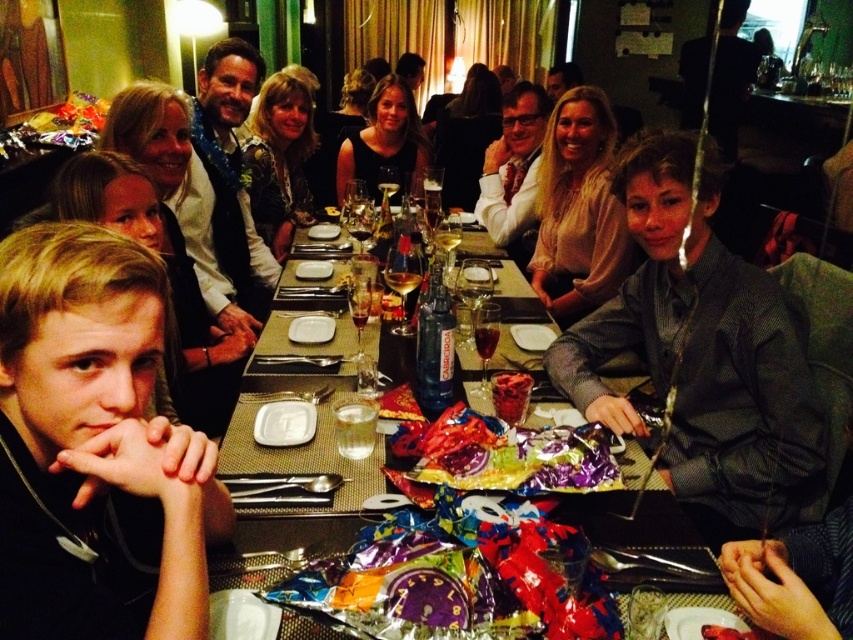
Question: Which point appears closest to the camera in this image?

Choices:
 (A) (376, 577)
 (B) (91, 544)
 (C) (799, 324)
 (D) (280, 145)

Answer: (B)

Question: From the image, what is the correct spatial relationship of dark gray shirt at center in relation to shiny metallic foil at center?

Choices:
 (A) above
 (B) below

Answer: (A)

Question: Can you confirm if black matte shirt at left is positioned above shiny foil wrapped candy at center?

Choices:
 (A) no
 (B) yes

Answer: (B)

Question: From the image, what is the correct spatial relationship of shiny metallic table at center in relation to black matte dress at center?

Choices:
 (A) left
 (B) right

Answer: (B)

Question: Which object is positioned closest to the light beige blouse at upper center?

Choices:
 (A) white textured shirt at center
 (B) shiny metallic foil at center
 (C) black matte shirt at left

Answer: (A)

Question: Which object is the farthest from the shiny metallic foil at center?

Choices:
 (A) dark gray shirt at center
 (B) matte black dress at center

Answer: (B)